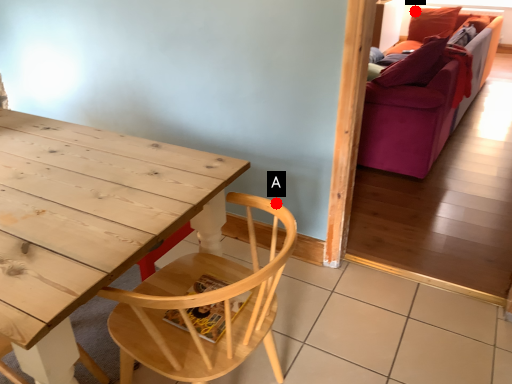
Question: Two points are circled on the image, labeled by A and B beside each circle. Which point is farther from the camera taking this photo?

Choices:
 (A) A is further
 (B) B is further

Answer: (B)